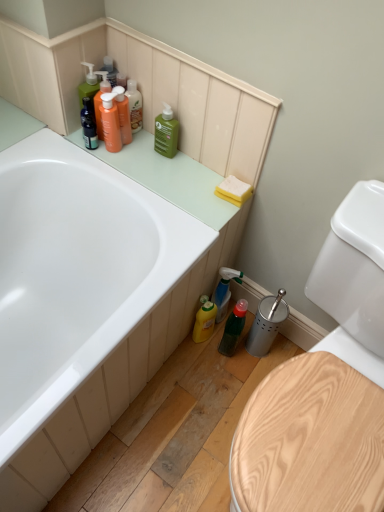
At what (x,y) coordinates should I click in order to perform the action: click on free location to the right of translucent orange bottles at upper left, which ranks as the second toiletry in top-to-bottom order. Please return your answer as a coordinate pair (x, y). Looking at the image, I should click on (163, 162).